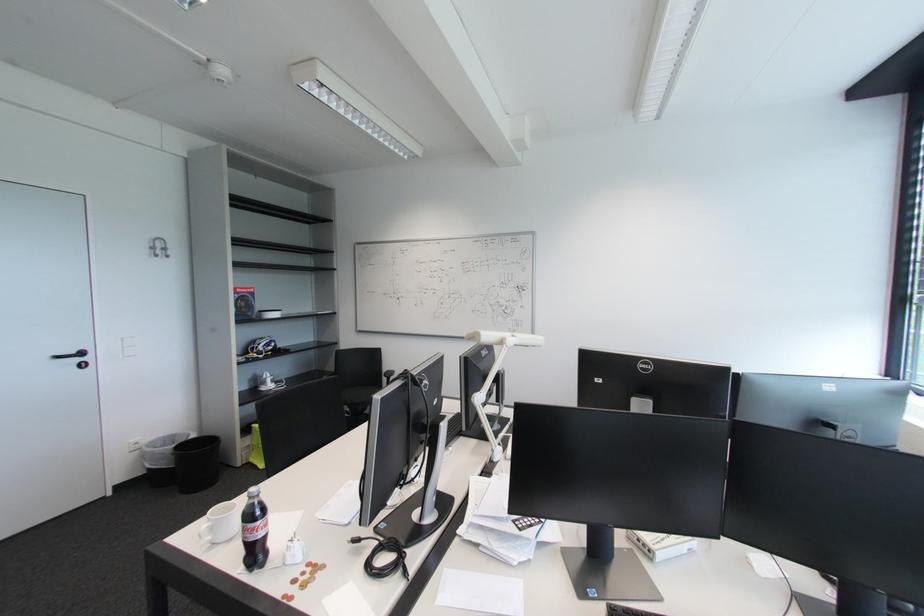
Identify the location of white mug handle. (221, 523).